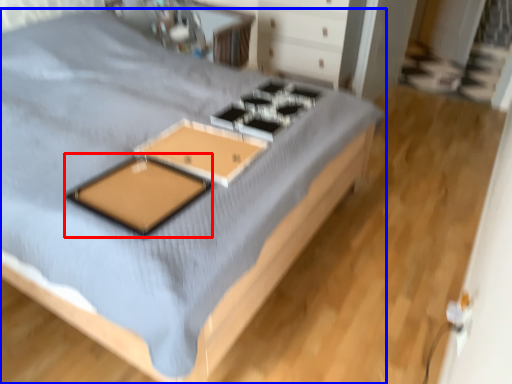
Question: Which of the following is the closest to the observer, pad (highlighted by a red box) or bed (highlighted by a blue box)?

Choices:
 (A) pad
 (B) bed

Answer: (B)